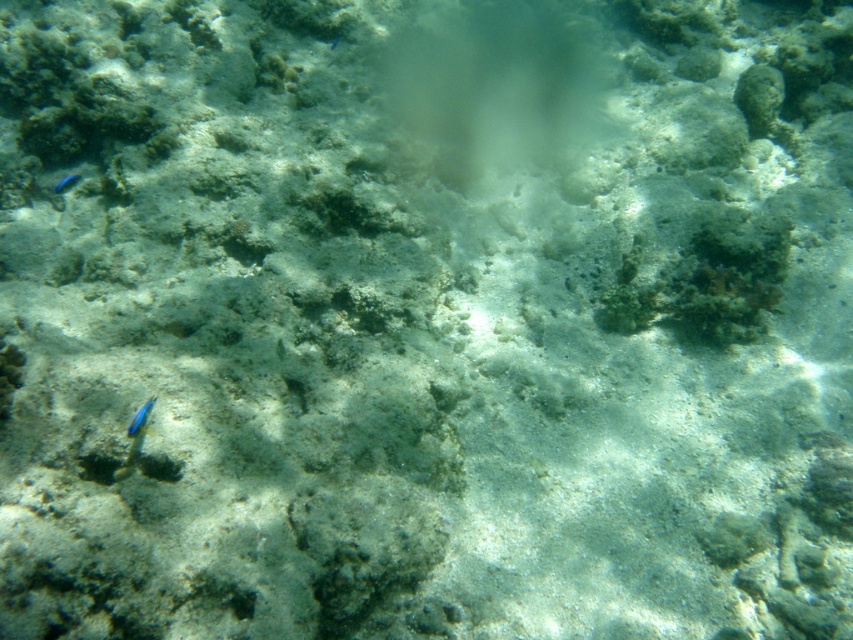
Between blue glossy fish at lower left and blue glossy fish at upper left, which one appears on the right side from the viewer's perspective?

Positioned to the right is blue glossy fish at lower left.

Can you confirm if blue glossy fish at lower left is bigger than blue glossy fish at upper left?

Actually, blue glossy fish at lower left might be smaller than blue glossy fish at upper left.

Where is `blue glossy fish at lower left`? blue glossy fish at lower left is located at coordinates (138, 417).

Identify the location of blue glossy fish at lower left. (138, 417).